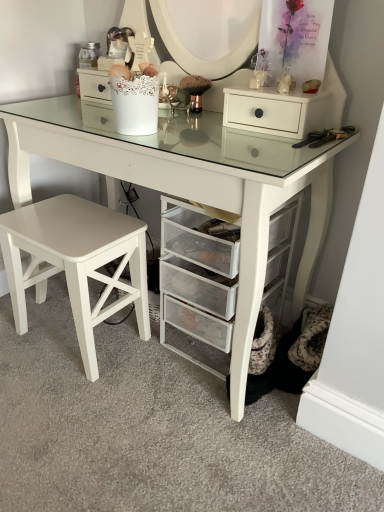
Question: Is white matte drawer at upper right beside white matte stool at lower left?

Choices:
 (A) no
 (B) yes

Answer: (A)

Question: From a real-world perspective, is white matte drawer at upper right below white matte stool at lower left?

Choices:
 (A) no
 (B) yes

Answer: (A)

Question: Is white matte drawer at upper right outside white matte stool at lower left?

Choices:
 (A) no
 (B) yes

Answer: (B)

Question: Is white matte drawer at upper right aimed at white matte stool at lower left?

Choices:
 (A) no
 (B) yes

Answer: (A)

Question: Is white matte drawer at upper right turned away from white matte stool at lower left?

Choices:
 (A) no
 (B) yes

Answer: (A)

Question: Looking at their shapes, would you say white matte stool at lower left is wider or thinner than white glossy table at center?

Choices:
 (A) wide
 (B) thin

Answer: (B)

Question: Is white matte stool at lower left taller or shorter than white glossy table at center?

Choices:
 (A) short
 (B) tall

Answer: (A)

Question: From the image's perspective, is white matte stool at lower left positioned above or below white glossy table at center?

Choices:
 (A) above
 (B) below

Answer: (B)

Question: Relative to white glossy table at center, is white matte stool at lower left in front or behind?

Choices:
 (A) front
 (B) behind

Answer: (B)

Question: From a real-world perspective, relative to white matte stool at lower left, is white matte drawer at upper right vertically above or below?

Choices:
 (A) above
 (B) below

Answer: (A)

Question: Does point (241, 95) appear closer or farther from the camera than point (23, 284)?

Choices:
 (A) closer
 (B) farther

Answer: (A)

Question: Would you say white matte drawer at upper right is to the left or to the right of white matte stool at lower left in the picture?

Choices:
 (A) left
 (B) right

Answer: (B)

Question: Which is correct: white matte drawer at upper right is inside white matte stool at lower left, or outside of it?

Choices:
 (A) outside
 (B) inside

Answer: (A)

Question: From their relative heights in the image, would you say clear mesh drawers at center is taller or shorter than white matte drawer at upper right?

Choices:
 (A) short
 (B) tall

Answer: (B)

Question: Is clear mesh drawers at center to the left or to the right of white matte drawer at upper right in the image?

Choices:
 (A) left
 (B) right

Answer: (A)